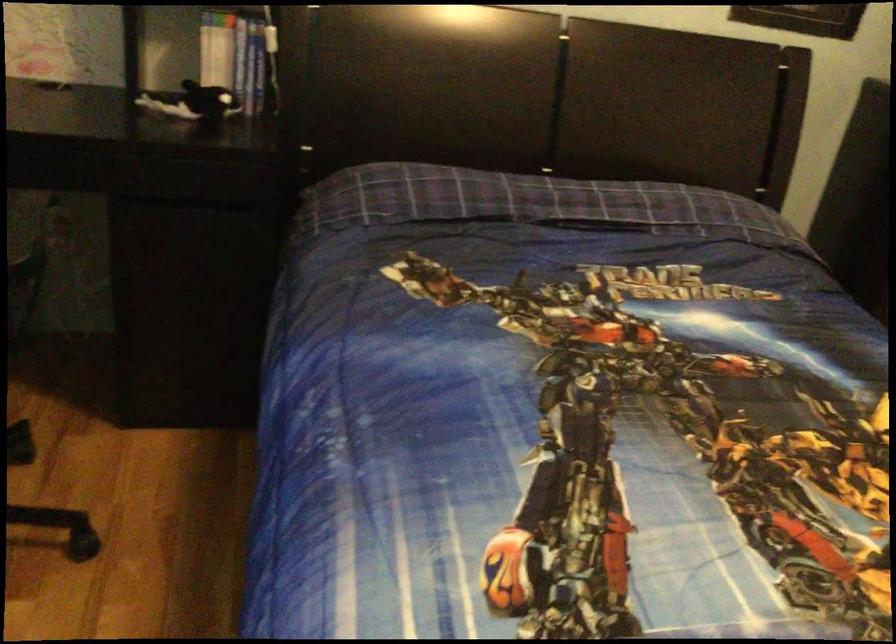
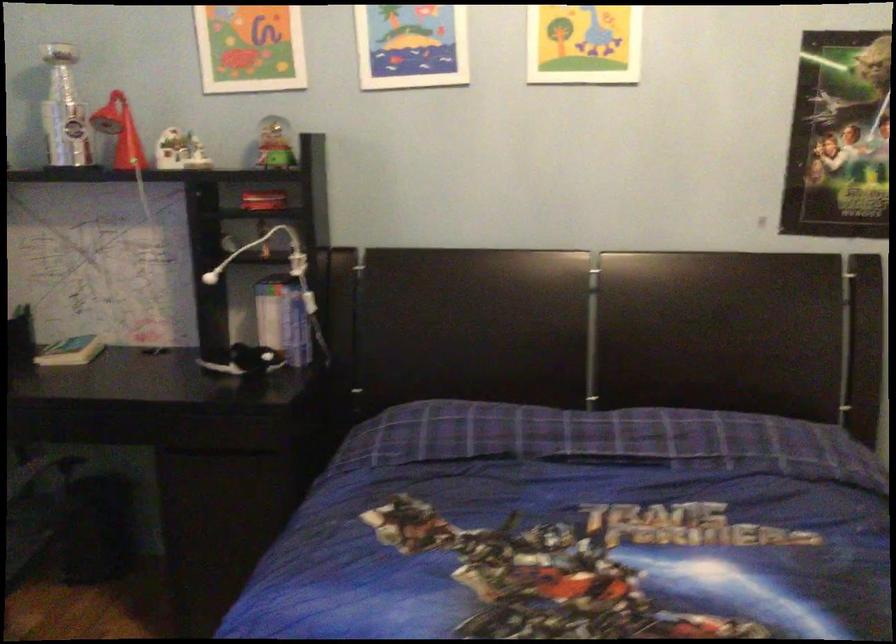
Locate, in the second image, the point that corresponds to point (431, 193) in the first image.

(440, 431)